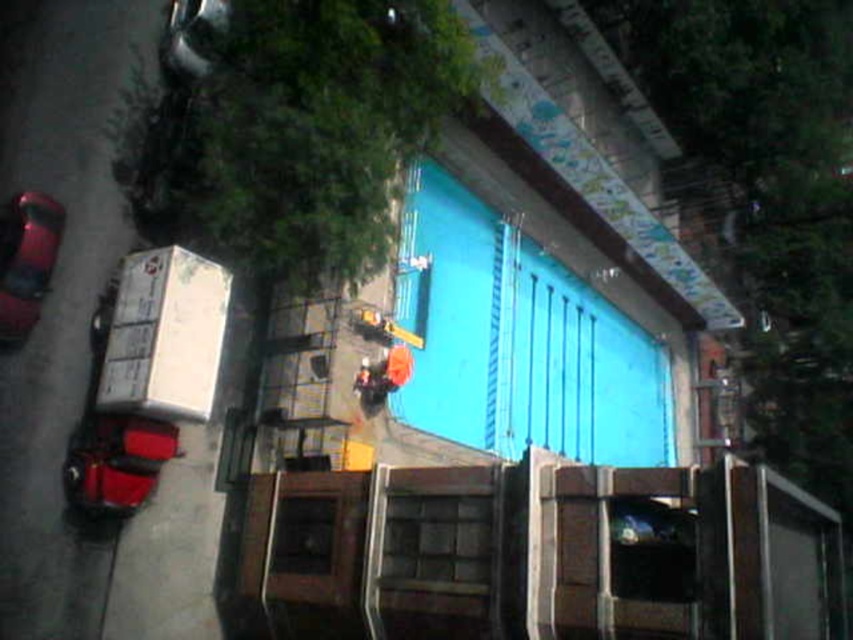
Question: Which of the following is the farthest from the observer?

Choices:
 (A) orange fabric construction worker at center
 (B) shiny red car at left

Answer: (A)

Question: Which object appears closest to the camera in this image?

Choices:
 (A) orange fabric construction worker at center
 (B) shiny red car at left

Answer: (B)

Question: Does shiny red car at left have a larger size compared to orange fabric construction worker at center?

Choices:
 (A) no
 (B) yes

Answer: (A)

Question: Where is shiny red car at left located in relation to orange fabric construction worker at center in the image?

Choices:
 (A) right
 (B) left

Answer: (B)

Question: Does shiny red car at left appear under orange fabric construction worker at center?

Choices:
 (A) no
 (B) yes

Answer: (A)